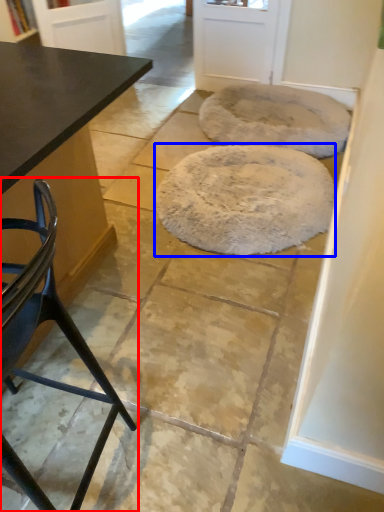
Question: Which object is further to the camera taking this photo, chair (highlighted by a red box) or mat (highlighted by a blue box)?

Choices:
 (A) chair
 (B) mat

Answer: (B)